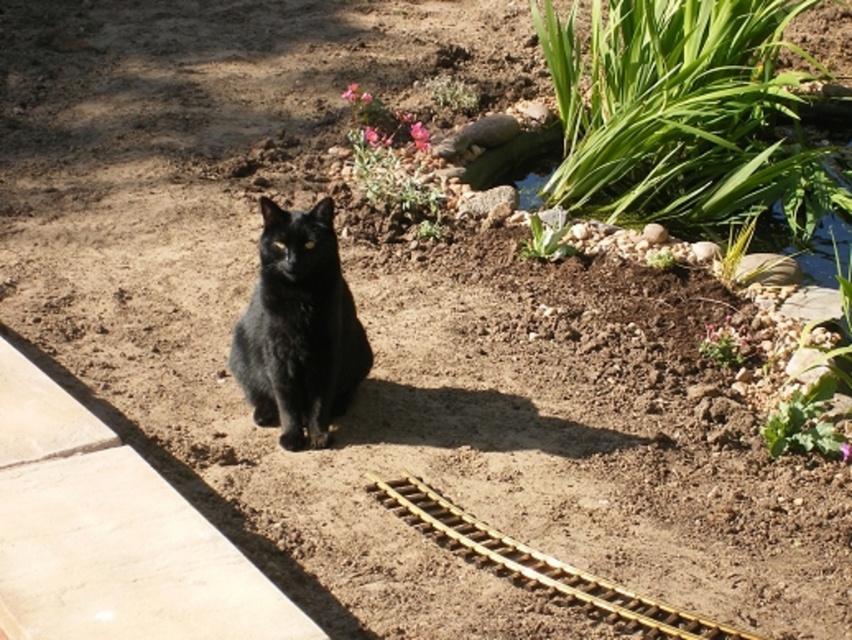
Question: From the image, what is the correct spatial relationship of black fur cat at center in relation to gold metallic train track at center?

Choices:
 (A) left
 (B) right

Answer: (A)

Question: Does black fur cat at center have a lesser width compared to gold metallic train track at center?

Choices:
 (A) yes
 (B) no

Answer: (A)

Question: In this image, where is black fur cat at center located relative to gold metallic train track at center?

Choices:
 (A) below
 (B) above

Answer: (B)